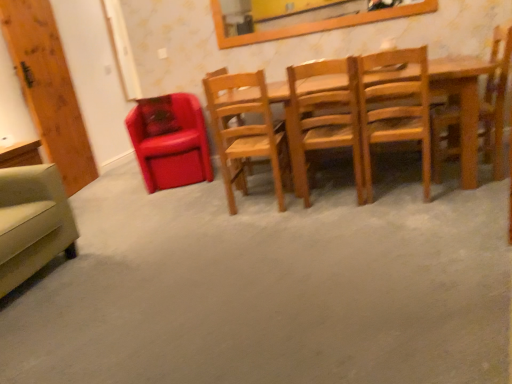
Find the location of `vacant space underneath wooden chair at center, arranged as the third chair when viewed from the left (from a real-world perspective)`. vacant space underneath wooden chair at center, arranged as the third chair when viewed from the left (from a real-world perspective) is located at coordinates (257, 200).